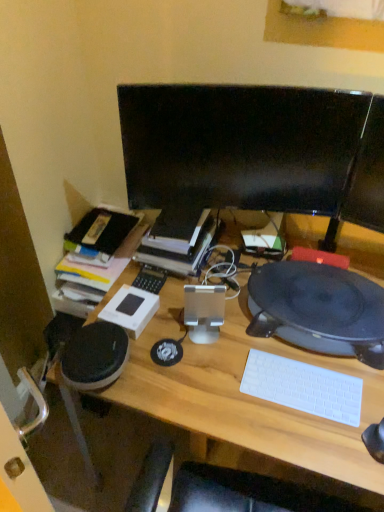
This screenshot has height=512, width=384. What do you see at coordinates (178, 241) in the screenshot?
I see `hardcover book at center` at bounding box center [178, 241].

The width and height of the screenshot is (384, 512). What do you see at coordinates (303, 387) in the screenshot?
I see `white plastic keyboard at lower right` at bounding box center [303, 387].

What is the approximate height of white plastic keyboard at lower right?

The height of white plastic keyboard at lower right is 0.78 inches.

Describe the element at coordinates (239, 145) in the screenshot. This screenshot has width=384, height=512. I see `black glossy monitor at center` at that location.

What do you see at coordinates (318, 309) in the screenshot? I see `black matte record player at right` at bounding box center [318, 309].

You are a GUI agent. You are given a task and a screenshot of the screen. Output one action in this format:
    pyautogui.click(x=<x>, y=<y>)
    Task: Click on the wooden desk at center
    The height and width of the screenshot is (512, 384).
    Given the screenshot: What is the action you would take?
    pyautogui.click(x=172, y=388)

This screenshot has width=384, height=512. I want to click on hardcover book at center, so click(x=178, y=241).

Is black glossy monitor at center wider or thinner than white plastic keyboard at lower right?

black glossy monitor at center is thinner than white plastic keyboard at lower right.

Looking at this image, which is more to the left, black glossy monitor at center or white plastic keyboard at lower right?

Positioned to the left is black glossy monitor at center.

Which of these two, black glossy monitor at center or white plastic keyboard at lower right, is bigger?

With larger size is black glossy monitor at center.

Considering the sizes of wooden desk at center and black glossy monitor at center in the image, is wooden desk at center bigger or smaller than black glossy monitor at center?

Considering their sizes, wooden desk at center takes up more space than black glossy monitor at center.

From the image's perspective, is wooden desk at center above or below black glossy monitor at center?

wooden desk at center is below black glossy monitor at center.

How many degrees apart are the facing directions of wooden desk at center and black glossy monitor at center?

The angular difference between wooden desk at center and black glossy monitor at center is 163 degrees.

Considering their positions, is black glossy monitor at center located in front of or behind wooden desk at center?

black glossy monitor at center is positioned farther from the viewer than wooden desk at center.

Could you tell me if black glossy monitor at center is turned towards wooden desk at center?

Yes, black glossy monitor at center is facing wooden desk at center.

Is point (335, 208) positioned after point (51, 379)?

No, (335, 208) is closer to viewer.

Does point (133, 236) appear closer or farther from the camera than point (140, 252)?

Point (133, 236).

How many degrees apart are the facing directions of wooden desk at center and hardcover book at center?

wooden desk at center and hardcover book at center are facing 179 degrees away from each other.

Does wooden desk at center have a smaller size compared to hardcover book at center?

Actually, wooden desk at center might be larger than hardcover book at center.

Looking at this image, can you confirm if wooden desk at center is thinner than hardcover book at center?

Incorrect, the width of wooden desk at center is not less than that of hardcover book at center.

Can you confirm if white plastic keyboard at lower right is positioned to the right of wooden desk at center?

Yes, white plastic keyboard at lower right is to the right of wooden desk at center.

From a real-world perspective, who is located lower, white plastic keyboard at lower right or wooden desk at center?

wooden desk at center, from a real-world perspective.

Would you say white plastic keyboard at lower right is a long distance from wooden desk at center?

white plastic keyboard at lower right is near wooden desk at center, not far away.

From the image's perspective, is white plastic keyboard at lower right above or below wooden desk at center?

white plastic keyboard at lower right is situated higher than wooden desk at center in the image.

Are white plastic keyboard at lower right and hardcover book at center beside each other?

No, white plastic keyboard at lower right is not making contact with hardcover book at center.

How many degrees apart are the facing directions of white plastic keyboard at lower right and hardcover book at center?

They differ by 1.02 degrees in their facing directions.

From the image's perspective, which is below, white plastic keyboard at lower right or hardcover book at center?

From the image's view, white plastic keyboard at lower right is below.

From the image's perspective, who appears lower, black matte record player at right or hardcover book at center?

black matte record player at right is shown below in the image.

Is black matte record player at right positioned far away from hardcover book at center?

No, black matte record player at right is not far away from hardcover book at center.

Image resolution: width=384 pixels, height=512 pixels. Find the location of `book that is behind the black matte record player at right`. book that is behind the black matte record player at right is located at coordinates (178, 241).

Considering the relative sizes of black matte record player at right and hardcover book at center in the image provided, is black matte record player at right shorter than hardcover book at center?

Yes.

Where is `computer keyboard on the right side of black glossy monitor at center`? This screenshot has width=384, height=512. computer keyboard on the right side of black glossy monitor at center is located at coordinates (303, 387).

Identify the location of desk below the black glossy monitor at center (from the image's perspective). This screenshot has width=384, height=512. (172, 388).

Estimate the real-world distances between objects in this image. Which object is further from black glossy monitor at center, white plastic keyboard at lower right or hardcover book at center?

Based on the image, white plastic keyboard at lower right appears to be further to black glossy monitor at center.

From the image, which object appears to be nearer to white plastic keyboard at lower right, hardcover book at center or black glossy monitor at center?

hardcover book at center is positioned closer to the anchor white plastic keyboard at lower right.

Which object lies further to the anchor point wooden desk at center, hardcover book at center or white plastic keyboard at lower right?

white plastic keyboard at lower right.

Looking at the image, which one is located further to black glossy monitor at center, white plastic keyboard at lower right or black matte record player at right?

white plastic keyboard at lower right is further to black glossy monitor at center.

Based on their spatial positions, is black glossy monitor at center or white plastic keyboard at lower right further from black matte record player at right?

The object further to black matte record player at right is black glossy monitor at center.

Which object lies nearer to the anchor point wooden desk at center, black glossy monitor at center or hardcover book at center?

Based on the image, hardcover book at center appears to be nearer to wooden desk at center.

Estimate the real-world distances between objects in this image. Which object is further from black matte record player at right, white plastic keyboard at lower right or black glossy monitor at center?

black glossy monitor at center is positioned further to the anchor black matte record player at right.

Considering their positions, is hardcover book at center positioned closer to white plastic keyboard at lower right than wooden desk at center?

Among the two, wooden desk at center is located nearer to white plastic keyboard at lower right.

You are a GUI agent. You are given a task and a screenshot of the screen. Output one action in this format:
    pyautogui.click(x=<x>, y=<y>)
    Task: Click on the computer between wooden desk at center and black glossy monitor at center along the z-axis
    
    Given the screenshot: What is the action you would take?
    pyautogui.click(x=318, y=309)

I want to click on book between black glossy monitor at center and white plastic keyboard at lower right from top to bottom, so click(178, 241).

Find the location of a particular element. The height and width of the screenshot is (512, 384). computer keyboard between wooden desk at center and black matte record player at right along the z-axis is located at coordinates (303, 387).

Find the location of a particular element. computer keyboard located between wooden desk at center and black glossy monitor at center in the depth direction is located at coordinates (303, 387).